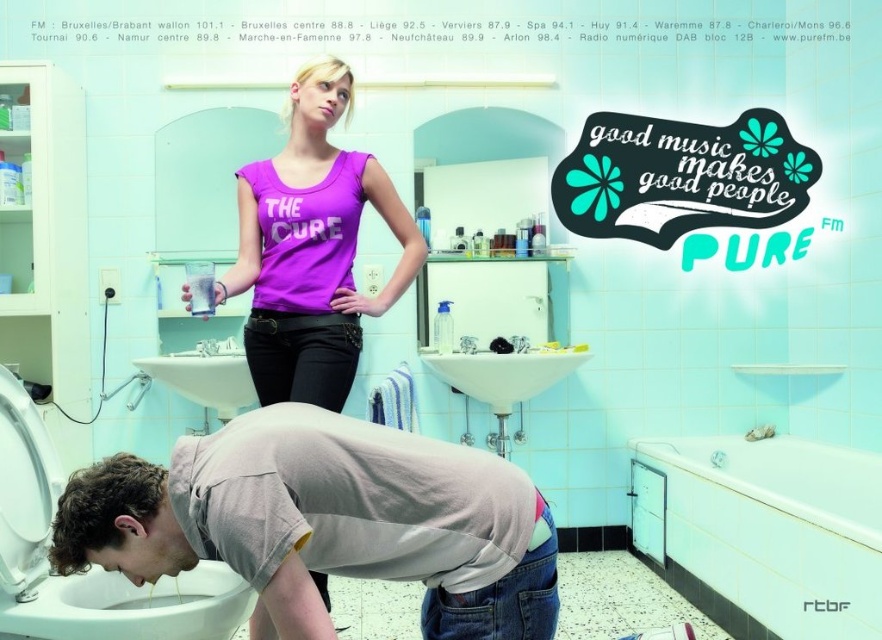
Question: Which of the following is the farthest from the observer?

Choices:
 (A) (234, 557)
 (B) (258, 273)
 (C) (210, 404)
 (D) (36, 477)

Answer: (C)

Question: Does purple matte tank top at upper center appear on the left side of white glossy toilet bowl at lower left?

Choices:
 (A) yes
 (B) no

Answer: (B)

Question: Can you confirm if gray cotton shirt at lower center is thinner than purple matte tank top at upper center?

Choices:
 (A) no
 (B) yes

Answer: (A)

Question: Is gray cotton shirt at lower center wider than white glossy toilet bowl at lower left?

Choices:
 (A) yes
 (B) no

Answer: (A)

Question: Which of the following is the closest to the observer?

Choices:
 (A) (191, 573)
 (B) (222, 378)

Answer: (A)

Question: Which object appears closest to the camera in this image?

Choices:
 (A) white ceramic sink at center
 (B) purple matte tank top at upper center
 (C) white glossy toilet bowl at lower left
 (D) gray cotton shirt at lower center

Answer: (D)